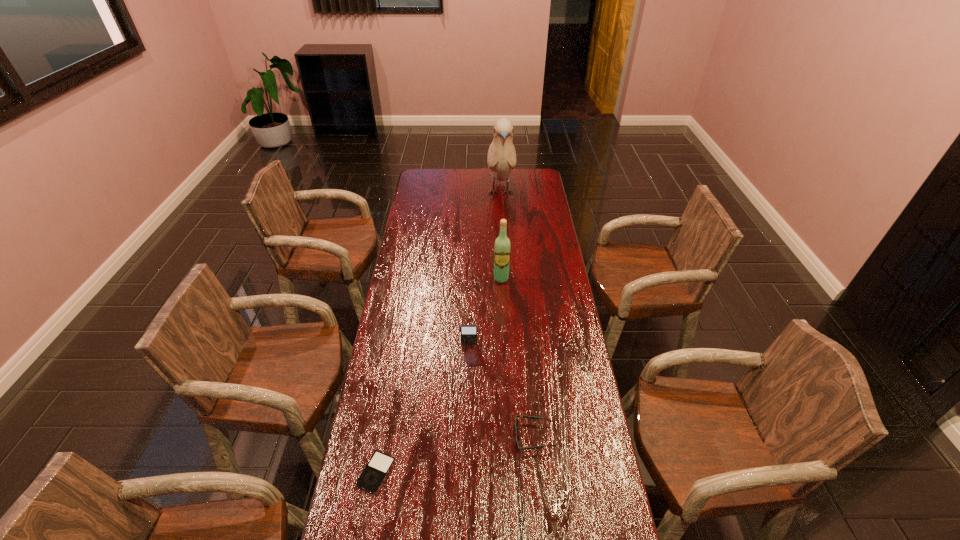
The width and height of the screenshot is (960, 540). I want to click on the farthest object, so point(501,159).

Locate an element on the screen. The height and width of the screenshot is (540, 960). parakeet is located at coordinates (501, 159).

Locate an element on the screen. the second farthest object is located at coordinates (502, 246).

Find the location of `the second tallest object`. the second tallest object is located at coordinates (502, 246).

Identify the location of the taller iPod. The image size is (960, 540). (469, 335).

Locate an element on the screen. the fourth object from right to left is located at coordinates (469, 335).

At what (x,y) coordinates should I click in order to perform the action: click on sunglasses. Please return your answer as a coordinate pair (x, y). The image size is (960, 540). Looking at the image, I should click on (524, 416).

Where is `the nearer iPod`? the nearer iPod is located at coordinates (375, 472).

I want to click on the shorter iPod, so click(375, 472).

I want to click on free region located 0.090m on the face of the farthest object, so click(502, 224).